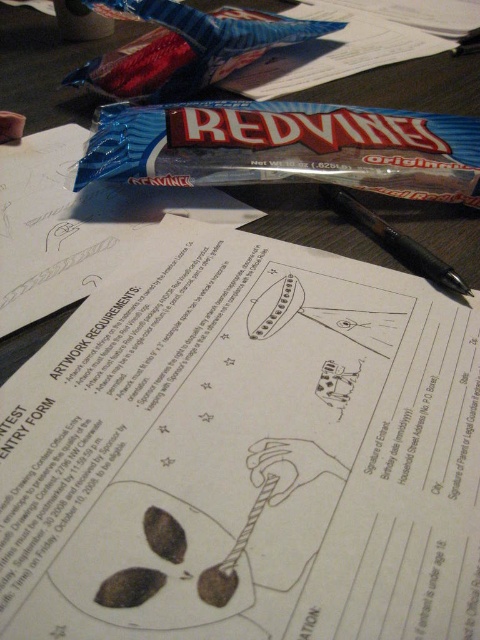
You need to sign the entry form but your hand is currently holding the black plastic pen at center. To reach the blue shiny candy at center, which is above the pen, do you need to move the pen first?

The blue shiny candy at center is above the black plastic pen at center, so you do not need to move the pen first to reach the candy.

Based on the photo, you need to sign the ENTRY FORM but the black plastic pen at center is under the blue shiny candy at center. Can you reach the pen without moving the candy?

The blue shiny candy at center is larger in size than the black plastic pen at center, so it might block access to the pen. You would need to move the candy to reach the pen.